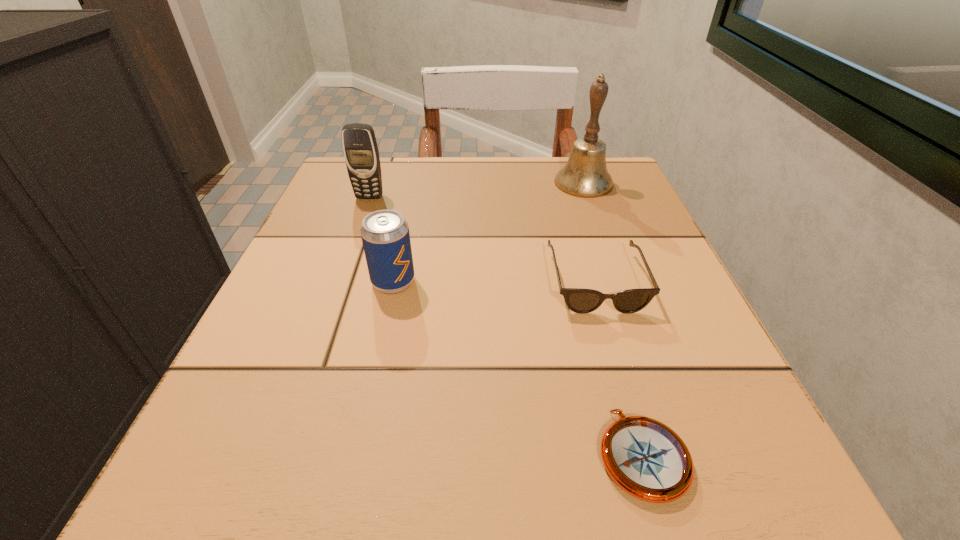
Locate an element on the screen. The width and height of the screenshot is (960, 540). object that is the fourth nearest to the sunglasses is located at coordinates (360, 149).

At what (x,y) coordinates should I click in order to perform the action: click on object that is the nearest to the fourth tallest object. Please return your answer as a coordinate pair (x, y). The image size is (960, 540). Looking at the image, I should click on (644, 457).

Where is `vacant space that satisfies the following two spatial constraints: 1. on the front face of the leftmost object; 2. on the right side of the nearest object`? This screenshot has width=960, height=540. vacant space that satisfies the following two spatial constraints: 1. on the front face of the leftmost object; 2. on the right side of the nearest object is located at coordinates (276, 454).

Where is `free region that satisfies the following two spatial constraints: 1. on the front side of the shortest object; 2. on the right side of the third shortest object`? Image resolution: width=960 pixels, height=540 pixels. free region that satisfies the following two spatial constraints: 1. on the front side of the shortest object; 2. on the right side of the third shortest object is located at coordinates (355, 454).